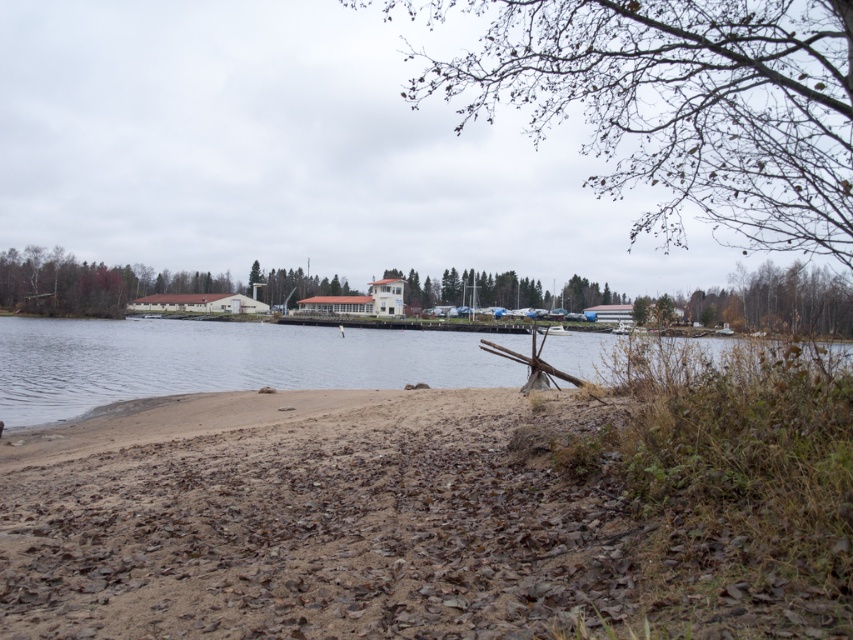
Question: Does brown sandy beach at lower left appear on the left side of clear water at center?

Choices:
 (A) yes
 (B) no

Answer: (B)

Question: Does bare branches at upper center have a greater width compared to clear water at center?

Choices:
 (A) yes
 (B) no

Answer: (B)

Question: Which of the following is the farthest from the observer?

Choices:
 (A) brown textured tree at upper right
 (B) green leafy tree at center

Answer: (B)

Question: Which point is closer to the camera taking this photo?

Choices:
 (A) (780, 330)
 (B) (207, 340)

Answer: (A)

Question: Does brown textured tree at upper right appear under green leafy tree at center?

Choices:
 (A) yes
 (B) no

Answer: (A)

Question: Estimate the real-world distances between objects in this image. Which object is farther from the clear water at center?

Choices:
 (A) green leafy tree at center
 (B) brown textured tree at upper right
 (C) brown sandy beach at lower left
 (D) bare branches at upper center

Answer: (B)